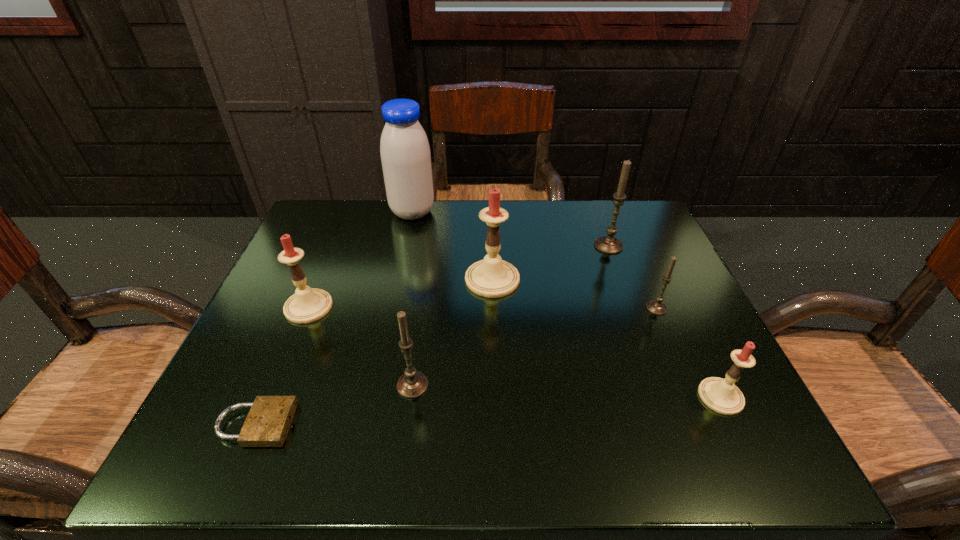
Where is `vacant space located on the left of the nearest red candle`? The width and height of the screenshot is (960, 540). vacant space located on the left of the nearest red candle is located at coordinates (516, 396).

The width and height of the screenshot is (960, 540). I want to click on free spot located 0.080m on the keyhole side of the padlock, so click(341, 424).

What are the coordinates of `soya milk located in the far edge section of the desktop` in the screenshot? It's located at (405, 153).

The height and width of the screenshot is (540, 960). What are the coordinates of `candle that is at the far edge` in the screenshot? It's located at (608, 244).

Where is `candle present at the near edge`? Image resolution: width=960 pixels, height=540 pixels. candle present at the near edge is located at coordinates (721, 395).

Identify the location of padlock at the near edge. (267, 424).

The height and width of the screenshot is (540, 960). In order to click on candle situated at the left edge in this screenshot , I will do `click(307, 305)`.

Find the location of `padlock located at the left edge`. padlock located at the left edge is located at coordinates (267, 424).

Where is `object that is at the near left corner`? Image resolution: width=960 pixels, height=540 pixels. object that is at the near left corner is located at coordinates (267, 424).

Locate an element on the screen. object that is at the far right corner is located at coordinates (608, 244).